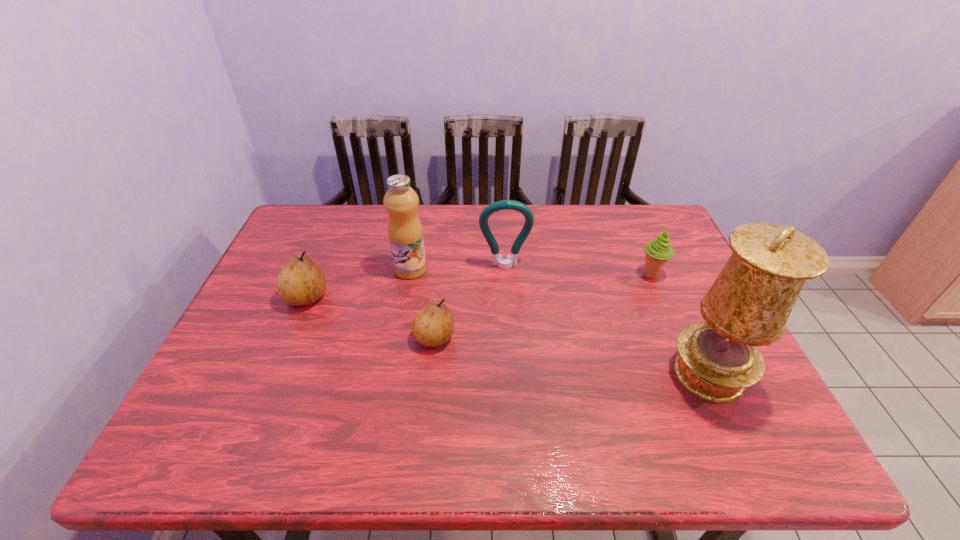
This screenshot has height=540, width=960. I want to click on free space located 0.130m on the left of the shortest object, so click(363, 338).

Find the location of `vacant area located at the jaws of the third tallest object`. vacant area located at the jaws of the third tallest object is located at coordinates (511, 358).

The width and height of the screenshot is (960, 540). In order to click on vacant space situated on the left of the icecream in this screenshot , I will do `click(576, 275)`.

I want to click on vacant space located on the front label of the fifth shortest object, so click(x=468, y=269).

The width and height of the screenshot is (960, 540). Identify the location of vacant region located 0.270m on the left of the tallest object. (554, 374).

At what (x,y) coordinates should I click in order to perform the action: click on object present at the near edge. Please return your answer as a coordinate pair (x, y). Looking at the image, I should click on (748, 305).

Locate an element on the screen. object located in the left edge section of the desktop is located at coordinates (301, 282).

Find the location of a particular element. icecream present at the right edge is located at coordinates (658, 251).

The height and width of the screenshot is (540, 960). In order to click on oil lamp located at the right edge in this screenshot , I will do `click(748, 305)`.

Find the location of a particular element. Image resolution: width=960 pixels, height=540 pixels. object that is at the near right corner is located at coordinates (748, 305).